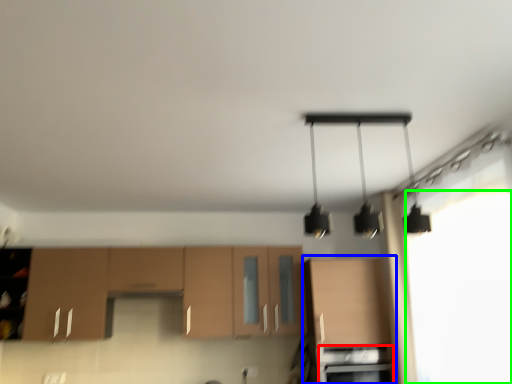
Question: Which object is positioned farthest from oven (highlighted by a red box)? Select from cabinetry (highlighted by a blue box) and window screen (highlighted by a green box).

Choices:
 (A) cabinetry
 (B) window screen

Answer: (B)